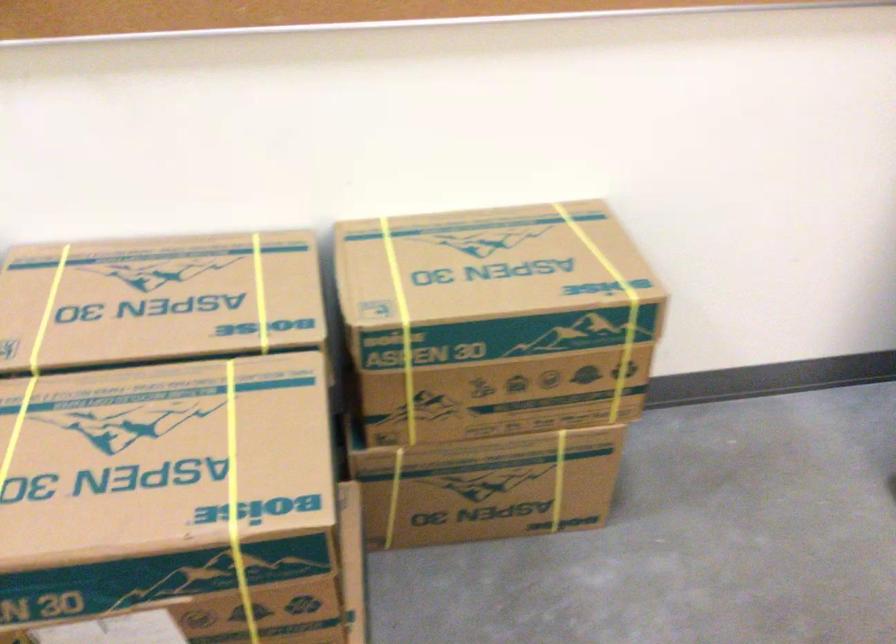
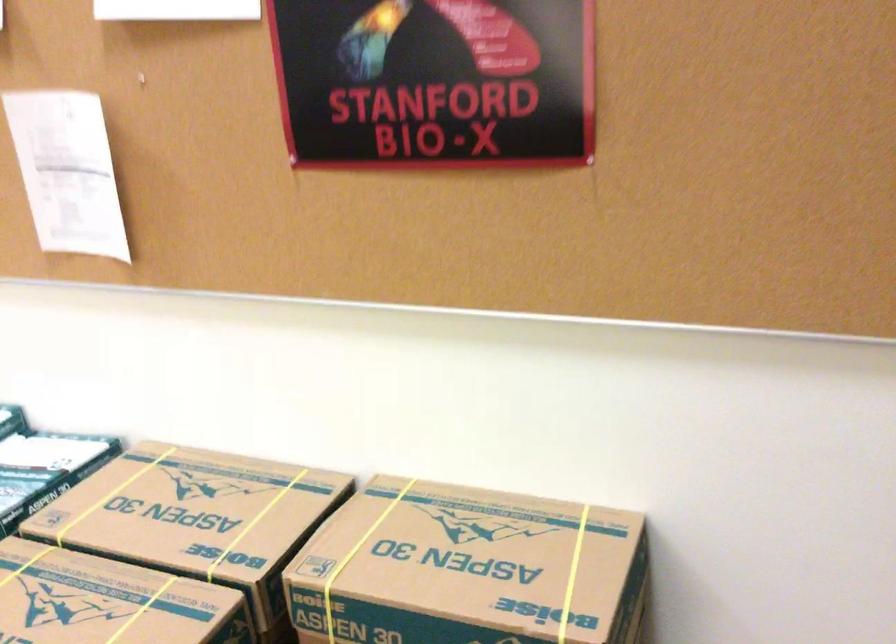
Question: The camera is either moving clockwise (left) or counter-clockwise (right) around the object. The first image is from the beginning of the video and the second image is from the end. Is the camera moving left or right when shooting the video?

Choices:
 (A) Left
 (B) Right

Answer: (B)